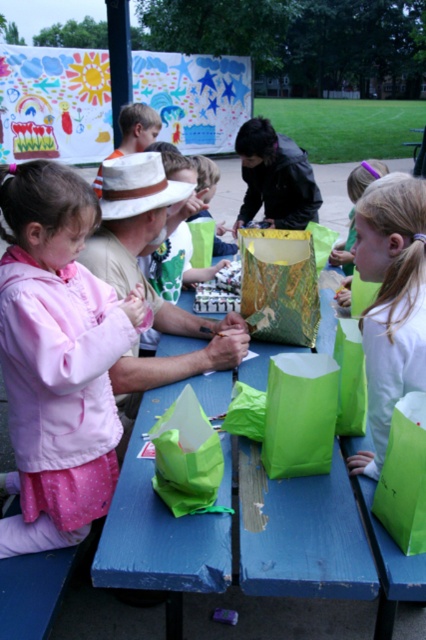
Describe the element at coordinates (57, 358) in the screenshot. This screenshot has width=426, height=640. I see `pink fabric dress at lower left` at that location.

Is point (57, 168) farther from camera compared to point (391, 333)?

Yes, it is behind point (391, 333).

I want to click on pink fabric dress at lower left, so click(x=57, y=358).

Find the location of a particular element. The height and width of the screenshot is (640, 426). pink fabric dress at lower left is located at coordinates (57, 358).

Who is more forward, (63,504) or (189,563)?

Point (189,563)

Consider the image. Is pink fabric dress at lower left taller than blue wood table at center?

Yes, pink fabric dress at lower left is taller than blue wood table at center.

Who is more forward, (x=74, y=369) or (x=284, y=492)?

Positioned in front is point (x=74, y=369).

Locate an element on the screen. This screenshot has height=640, width=426. pink fabric dress at lower left is located at coordinates (57, 358).

Which of these two, pink fabric dress at lower left or matte green paper bag at center, stands taller?

pink fabric dress at lower left is taller.

Describe the element at coordinates (57, 358) in the screenshot. I see `pink fabric dress at lower left` at that location.

Between point (74, 364) and point (227, 243), which one is positioned in front?

Point (74, 364) is in front.

Locate an element on the screen. This screenshot has height=640, width=426. pink fabric dress at lower left is located at coordinates (57, 358).